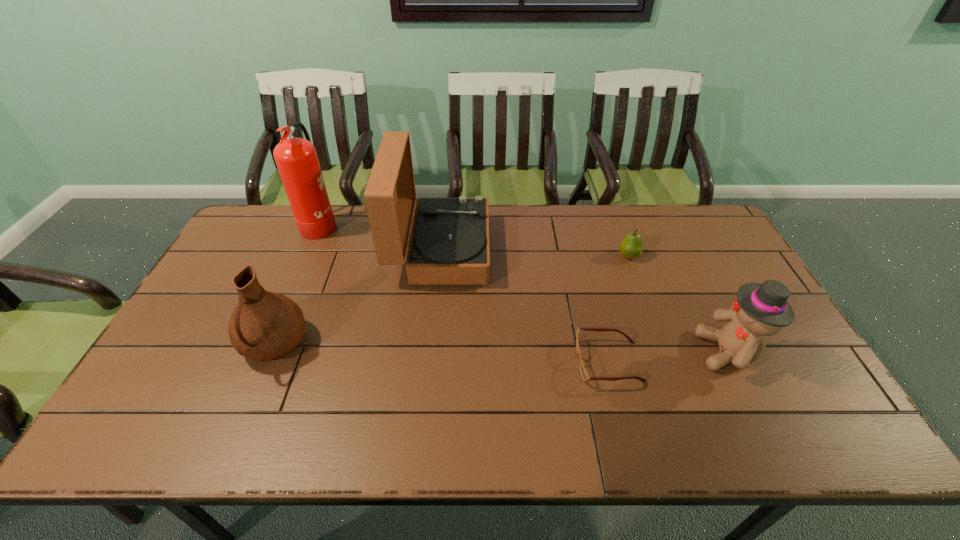
At what (x,y) coordinates should I click in order to perform the action: click on fire extinguisher. Please return your answer as a coordinate pair (x, y). This screenshot has width=960, height=540. Looking at the image, I should click on (296, 158).

Where is `the second tallest object`? the second tallest object is located at coordinates (449, 244).

Locate an element on the screen. Image resolution: width=960 pixels, height=540 pixels. phonograph record is located at coordinates (449, 244).

Locate an element on the screen. The height and width of the screenshot is (540, 960). pitcher is located at coordinates (264, 326).

Where is `rag_doll`? The height and width of the screenshot is (540, 960). rag_doll is located at coordinates (760, 310).

This screenshot has width=960, height=540. In order to click on the fifth object from left to right in this screenshot , I will do `click(631, 247)`.

Find the location of `the fifth tallest object`. the fifth tallest object is located at coordinates (631, 247).

Locate an element on the screen. Image resolution: width=960 pixels, height=540 pixels. the fourth object from left to right is located at coordinates (585, 376).

Locate an element on the screen. Image resolution: width=960 pixels, height=540 pixels. spectacles is located at coordinates click(585, 376).

Image resolution: width=960 pixels, height=540 pixels. I want to click on vacant space located 0.190m towards the nozzle of the fire extinguisher, so click(x=392, y=222).